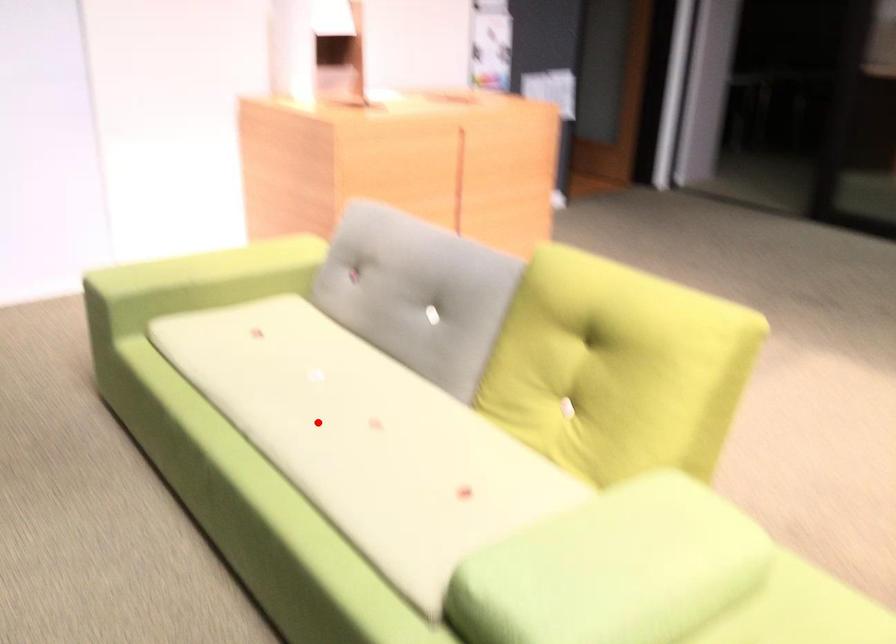
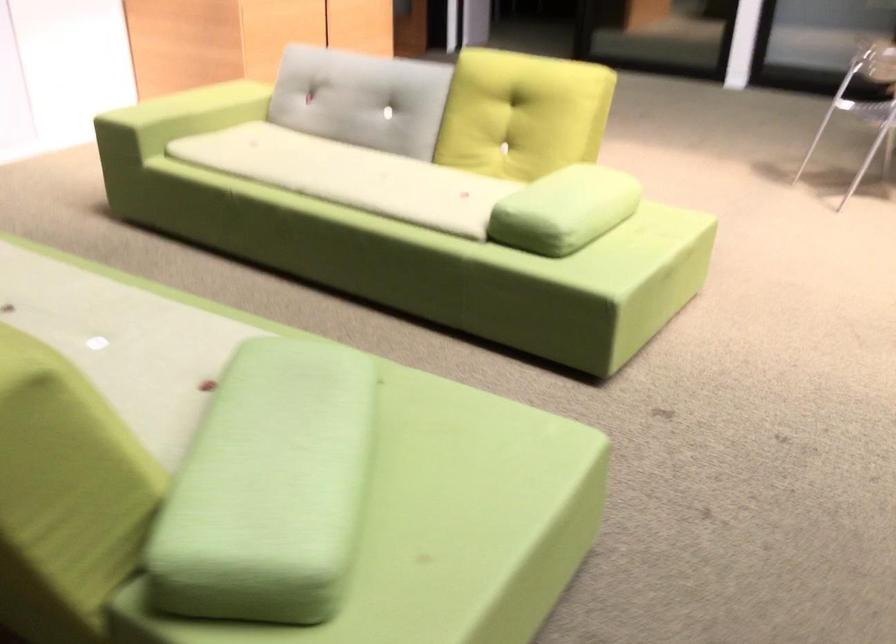
Locate, in the second image, the point that corresponds to the highlighted location in the first image.

(349, 176)